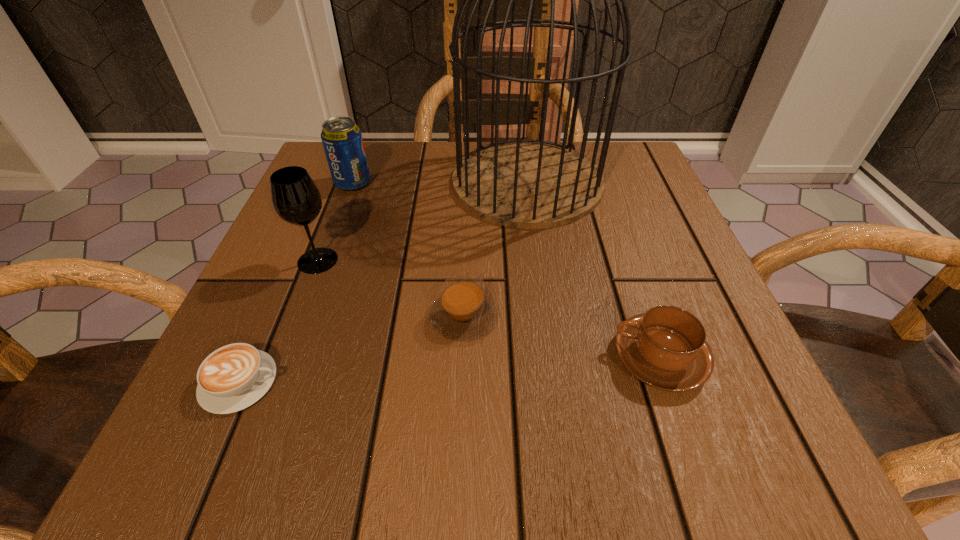
Locate an element on the screen. vacant space at the far edge is located at coordinates (444, 191).

Image resolution: width=960 pixels, height=540 pixels. Identify the location of vacant space at the near edge. (326, 413).

I want to click on blank space at the left edge, so click(295, 234).

The image size is (960, 540). In order to click on free space at the right edge in this screenshot , I will do `click(678, 273)`.

At what (x,y) coordinates should I click in order to perform the action: click on free space at the far left corner of the desktop. Please return your answer as a coordinate pair (x, y). This screenshot has height=540, width=960. Looking at the image, I should click on (378, 158).

This screenshot has width=960, height=540. Find the location of `vacant space at the far right corner of the desktop`. vacant space at the far right corner of the desktop is located at coordinates (612, 161).

The image size is (960, 540). What are the coordinates of `vacant area that lies between the second shortest cappuccino and the fourth shortest object` in the screenshot? It's located at pos(408,250).

Image resolution: width=960 pixels, height=540 pixels. I want to click on free space that is in between the shortest cappuccino and the rightmost cappuccino, so click(450, 370).

Find the location of a particular element. free space between the shortest object and the third farthest object is located at coordinates (279, 321).

Identify the location of unoccupied position between the leftmost cappuccino and the rightmost cappuccino. (450, 370).